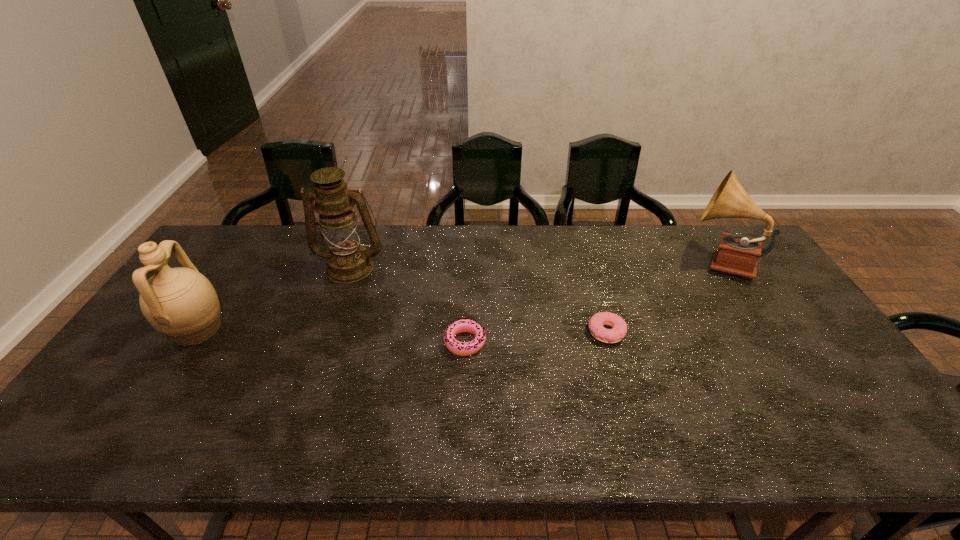
Image resolution: width=960 pixels, height=540 pixels. I want to click on free location at the far left corner of the desktop, so click(228, 242).

This screenshot has width=960, height=540. What are the coordinates of `free space between the rightmost object and the fourth object from right to left` in the screenshot? It's located at (535, 264).

Where is `empty location between the oil lamp and the phonograph record`? empty location between the oil lamp and the phonograph record is located at coordinates (535, 264).

Identify the location of free space between the rightmost object and the second object from left to right. (535, 264).

Where is `free spot between the pitcher and the third object from left to right`? free spot between the pitcher and the third object from left to right is located at coordinates (331, 336).

Locate an element on the screen. The width and height of the screenshot is (960, 540). empty location between the oil lamp and the fourth object from left to right is located at coordinates (478, 300).

Where is `empty location between the oil lamp and the leftmost object`? empty location between the oil lamp and the leftmost object is located at coordinates (274, 298).

Where is `free spot between the third object from left to right and the pitcher`? free spot between the third object from left to right and the pitcher is located at coordinates (331, 336).

At what (x,y) coordinates should I click in order to perform the action: click on vacant area that lies between the rightmost object and the pitcher. Please return your answer as a coordinate pair (x, y). Looking at the image, I should click on [x=458, y=295].

Find the location of a particular element. free space between the phonograph record and the left doughnut is located at coordinates (592, 301).